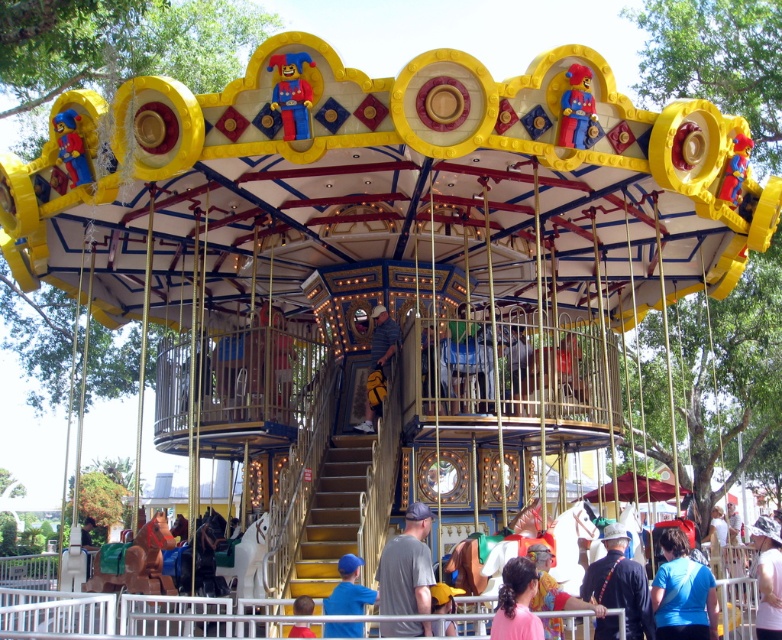
Who is taller, dark blue shirt at center or matte gray shirt at lower center?

matte gray shirt at lower center

Who is positioned more to the left, dark blue shirt at center or matte gray shirt at lower center?

dark blue shirt at center

Where is `dark blue shirt at center`? The width and height of the screenshot is (782, 640). dark blue shirt at center is located at coordinates (619, 582).

Is dark blue shirt at center wider than yellow fabric bag at center?

No, dark blue shirt at center is not wider than yellow fabric bag at center.

Does dark blue shirt at center have a smaller size compared to yellow fabric bag at center?

Correct, dark blue shirt at center occupies less space than yellow fabric bag at center.

Is point (605, 572) positioned before point (371, 417)?

Yes, point (605, 572) is closer to viewer.

This screenshot has width=782, height=640. I want to click on dark blue shirt at center, so click(619, 582).

Looking at this image, does blue fabric shirt at lower right have a larger size compared to blue fabric shirt at lower center?

No, blue fabric shirt at lower right is not bigger than blue fabric shirt at lower center.

You are a GUI agent. You are given a task and a screenshot of the screen. Output one action in this format:
    pyautogui.click(x=<x>, y=<y>)
    Task: Click on the blue fabric shirt at lower right
    This screenshot has height=640, width=782.
    Given the screenshot: What is the action you would take?
    pyautogui.click(x=682, y=593)

Does point (716, 616) come in front of point (350, 612)?

That is True.

The height and width of the screenshot is (640, 782). In order to click on blue fabric shirt at lower right in this screenshot , I will do 682,593.